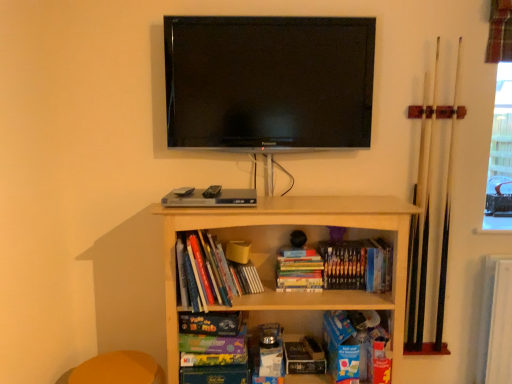
Question: Is hardcover book at center, which is the 1th book from right to left, bigger than flat screen tv at upper center?

Choices:
 (A) no
 (B) yes

Answer: (A)

Question: Is flat screen tv at upper center a part of hardcover book at center, which is the 1th book from right to left?

Choices:
 (A) no
 (B) yes

Answer: (A)

Question: Is hardcover book at center, which is counted as the third book, starting from the left, at the left side of flat screen tv at upper center?

Choices:
 (A) yes
 (B) no

Answer: (B)

Question: Is hardcover book at center, which is the 1th book from right to left, positioned with its back to flat screen tv at upper center?

Choices:
 (A) yes
 (B) no

Answer: (B)

Question: From a real-world perspective, is hardcover book at center, which is counted as the third book, starting from the left, physically above flat screen tv at upper center?

Choices:
 (A) no
 (B) yes

Answer: (A)

Question: Choose the correct answer: Is hardcover books at center, which appears as the third book when viewed from the right, inside matte purple paperback book at center, which is counted as the 2th paperback book, starting from the bottom, or outside it?

Choices:
 (A) inside
 (B) outside

Answer: (B)

Question: Considering the positions of hardcover books at center, the first book viewed from the left, and matte purple paperback book at center, which is counted as the 2th paperback book, starting from the bottom, in the image, is hardcover books at center, the first book viewed from the left, bigger or smaller than matte purple paperback book at center, which is counted as the 2th paperback book, starting from the bottom,?

Choices:
 (A) big
 (B) small

Answer: (A)

Question: Does point (179, 249) appear closer or farther from the camera than point (223, 344)?

Choices:
 (A) farther
 (B) closer

Answer: (B)

Question: From their relative heights in the image, would you say hardcover books at center, the first book viewed from the left, is taller or shorter than matte purple paperback book at center, the second paperback book when ordered from left to right?

Choices:
 (A) tall
 (B) short

Answer: (A)

Question: In terms of size, does green matte board game at center, the 3th paperback book positioned from the bottom, appear bigger or smaller than matte purple paperback book at center, the second paperback book when ordered from left to right?

Choices:
 (A) small
 (B) big

Answer: (B)

Question: Is point (217, 332) closer or farther from the camera than point (179, 337)?

Choices:
 (A) farther
 (B) closer

Answer: (A)

Question: From a real-world perspective, relative to matte purple paperback book at center, which is counted as the 2th paperback book, starting from the bottom, is green matte board game at center, which ranks as the first paperback book in left-to-right order, vertically above or below?

Choices:
 (A) below
 (B) above

Answer: (B)

Question: Considering their positions, is green matte board game at center, which ranks as the first paperback book in left-to-right order, located in front of or behind matte purple paperback book at center, the second paperback book when ordered from left to right?

Choices:
 (A) behind
 (B) front

Answer: (A)

Question: From the image's perspective, is hardcover book at center, which ranks as the 3th paperback book in top-to-bottom order, located above or below wooden shelf at center?

Choices:
 (A) above
 (B) below

Answer: (B)

Question: Based on their sizes in the image, would you say hardcover book at center, positioned as the first paperback book in right-to-left order, is bigger or smaller than wooden shelf at center?

Choices:
 (A) small
 (B) big

Answer: (A)